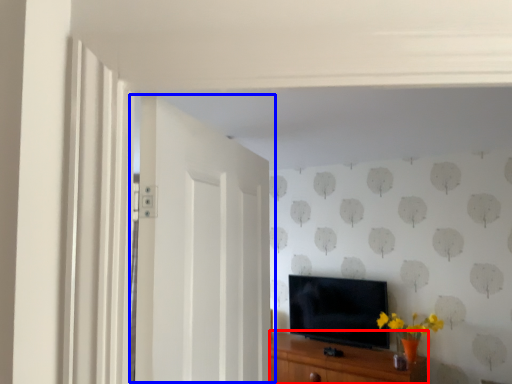
Question: Which of the following is the closest to the observer, cabinetry (highlighted by a red box) or door (highlighted by a blue box)?

Choices:
 (A) cabinetry
 (B) door

Answer: (B)